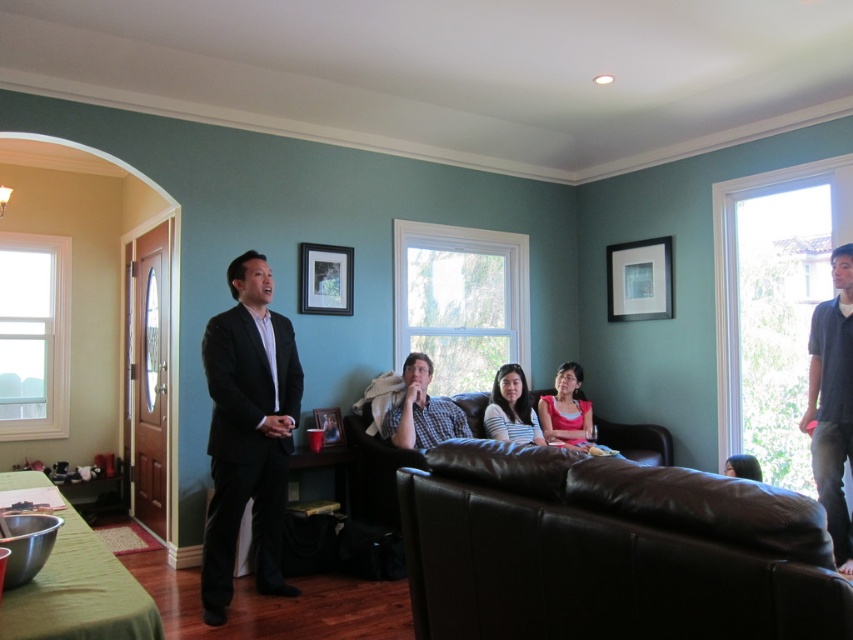
You are organizing a photoshoot and need to place two shirts on a display stand. The stand has a limited width. Given that the matte gray shirt at center is wider than the pink matte shirt at center, which shirt should you choose to ensure it fits on the stand without overlapping?

The pink matte shirt at center should be chosen because it is narrower than the matte gray shirt at center, making it more likely to fit on the display stand without overlapping.

You are standing in the living room and want to place a small decorative item on the wall between the two points, point (270, 481) and point (519, 385). Which point should you choose to ensure the item is closer to you?

You should choose point (270, 481) because it is closer to the viewer than point (519, 385).